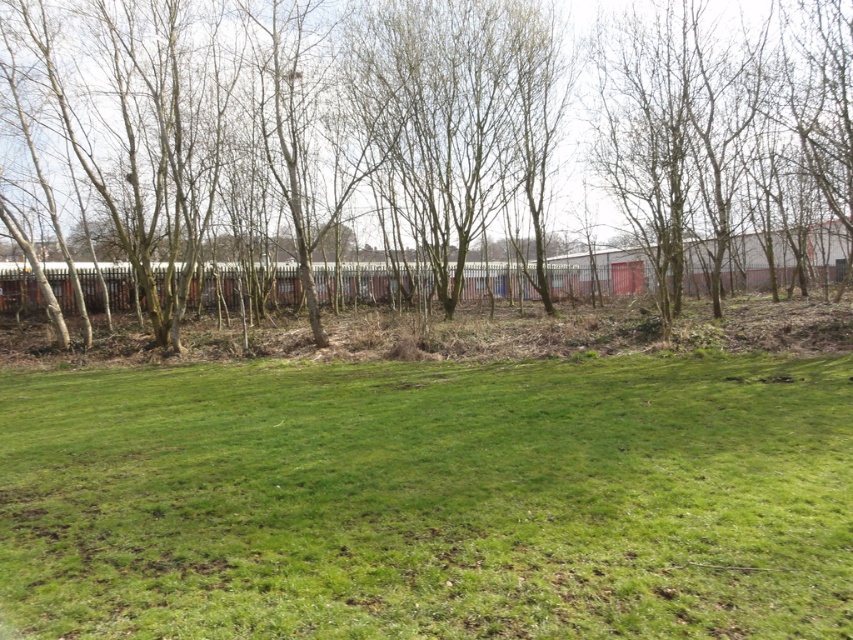
Which is more to the right, green grassy field at lower center or bare wood trees at center?

bare wood trees at center

Is point (4, 536) less distant than point (381, 173)?

That is True.

Between point (503, 467) and point (844, 129), which one is positioned in front?

Point (503, 467) is more forward.

I want to click on green grassy field at lower center, so click(430, 499).